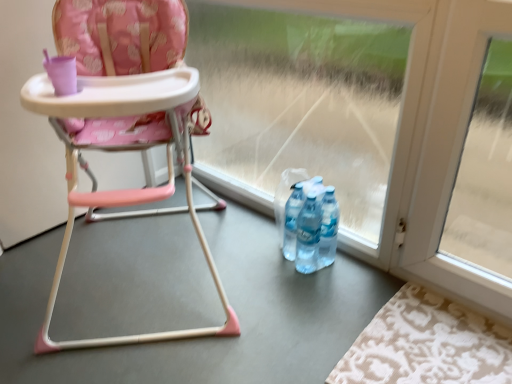
Find the location of `vacant space in between matte plastic highchair at center and beige damask rug at lower right`. vacant space in between matte plastic highchair at center and beige damask rug at lower right is located at coordinates (264, 310).